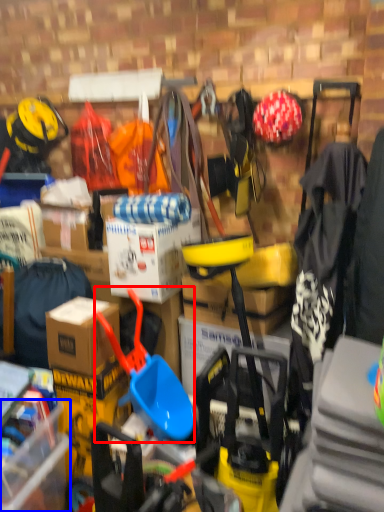
Question: Which point is closer to the camera, shovel (highlighted by a red box) or storage box (highlighted by a blue box)?

Choices:
 (A) shovel
 (B) storage box

Answer: (B)